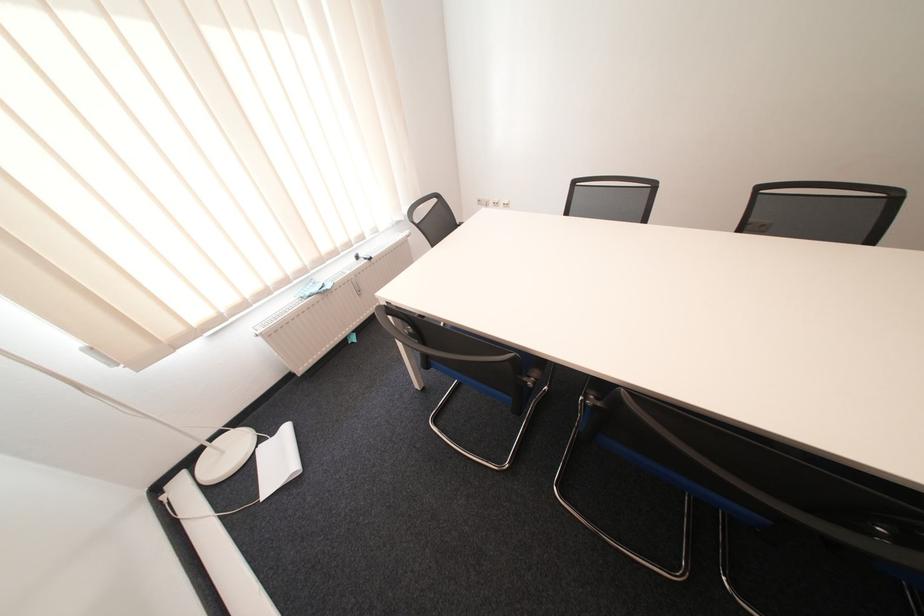
Find where to lift the white lamp base. Please return your answer as a coordinate pair (x, y).

(225, 456)